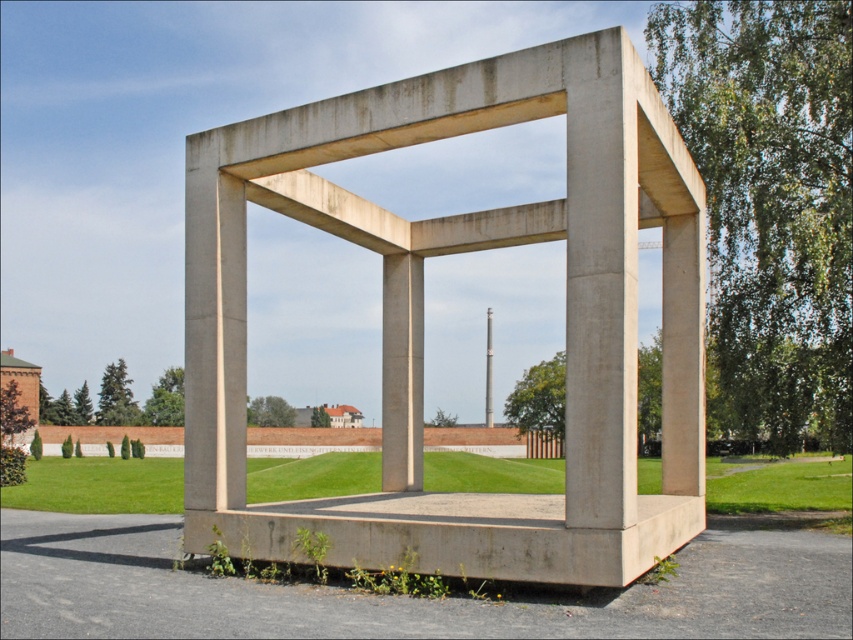
Question: Is smooth concrete frame at center to the right of concrete/rough pillar at center from the viewer's perspective?

Choices:
 (A) no
 (B) yes

Answer: (A)

Question: Does concrete frame at center have a smaller size compared to concrete/rough pillar at center?

Choices:
 (A) yes
 (B) no

Answer: (B)

Question: Based on their relative distances, which object is farther from the smooth concrete frame at center?

Choices:
 (A) concrete frame at center
 (B) concrete/rough pillar at center

Answer: (B)

Question: Which point appears farthest from the camera in this image?

Choices:
 (A) (486, 403)
 (B) (608, 486)

Answer: (A)

Question: Which point appears closest to the camera in this image?

Choices:
 (A) (413, 272)
 (B) (489, 416)
 (C) (149, 572)

Answer: (C)

Question: Can you confirm if concrete frame at center is positioned below smooth concrete frame at center?

Choices:
 (A) yes
 (B) no

Answer: (B)